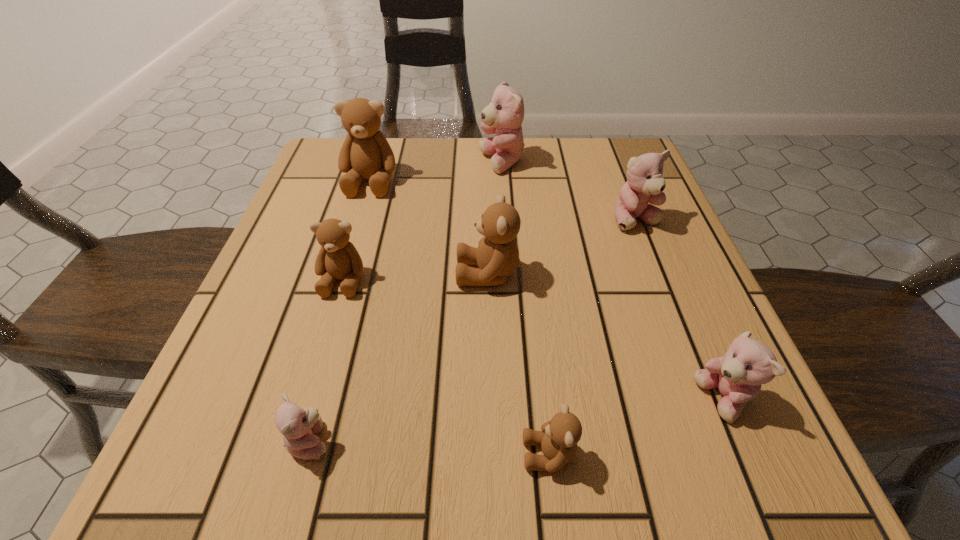
Identify the location of vacant area at the near edge. The width and height of the screenshot is (960, 540). (466, 440).

The height and width of the screenshot is (540, 960). Identify the location of free location at the left edge of the desktop. (301, 278).

The height and width of the screenshot is (540, 960). In order to click on free space at the right edge in this screenshot , I will do `click(721, 352)`.

In the image, there is a desktop. At what (x,y) coordinates should I click in order to perform the action: click on vacant space at the far left corner. Please return your answer as a coordinate pair (x, y). Looking at the image, I should click on (325, 160).

The height and width of the screenshot is (540, 960). In order to click on free space at the far right corner of the desktop in this screenshot , I will do `click(601, 171)`.

The image size is (960, 540). I want to click on free space at the near right corner of the desktop, so click(684, 425).

This screenshot has width=960, height=540. Find the location of `free space between the second farthest pink teddy bear and the leftmost pink teddy bear`. free space between the second farthest pink teddy bear and the leftmost pink teddy bear is located at coordinates (473, 330).

The image size is (960, 540). Find the location of `free space between the second biggest brown teddy bear and the farthest brown teddy bear`. free space between the second biggest brown teddy bear and the farthest brown teddy bear is located at coordinates (429, 227).

The height and width of the screenshot is (540, 960). Find the location of `vacant region between the second smallest brown teddy bear and the farthest pink teddy bear`. vacant region between the second smallest brown teddy bear and the farthest pink teddy bear is located at coordinates (422, 221).

Locate an element on the screen. The height and width of the screenshot is (540, 960). empty location between the third pink teddy bear from right to left and the nearest brown teddy bear is located at coordinates [x=525, y=308].